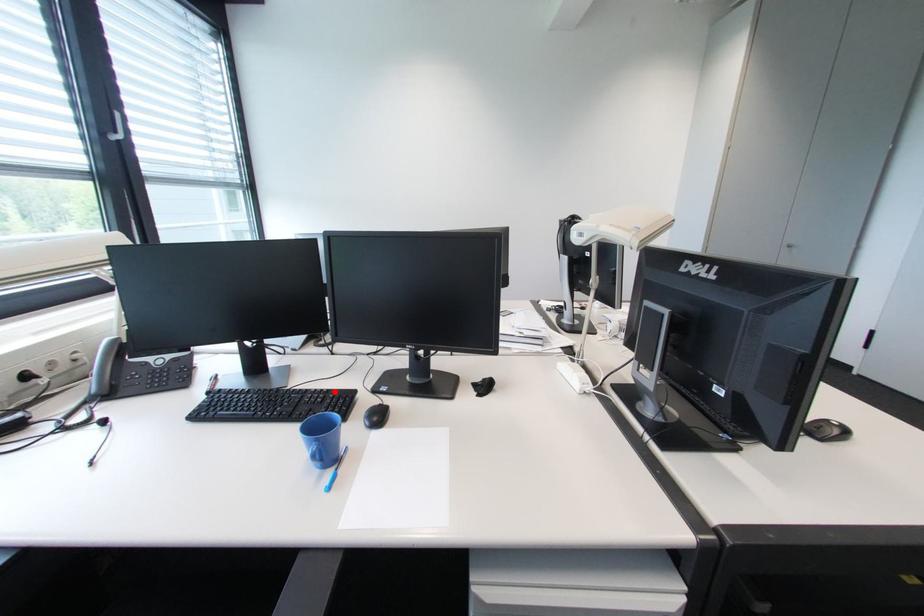
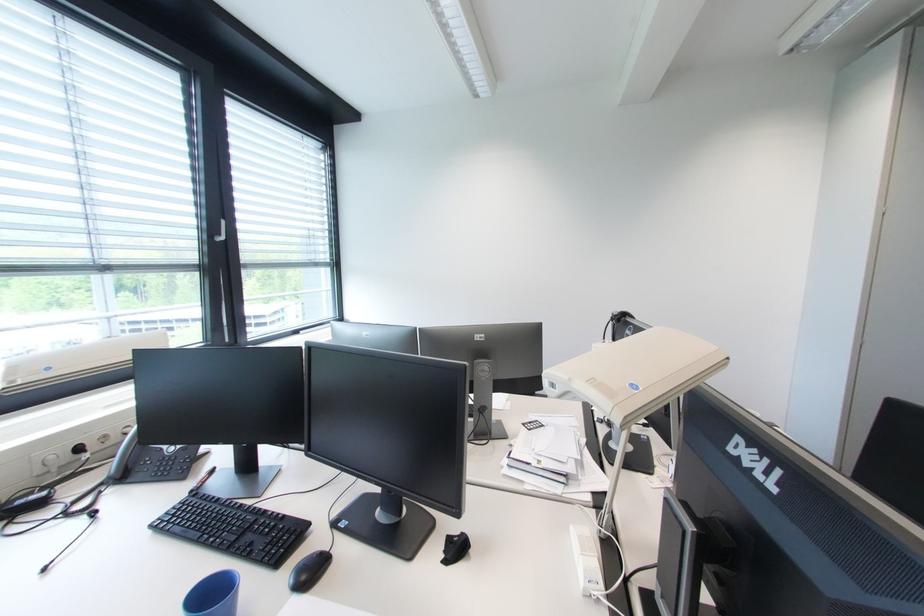
In the second image, find the point that corresponds to the highlighted location in the first image.

(290, 517)